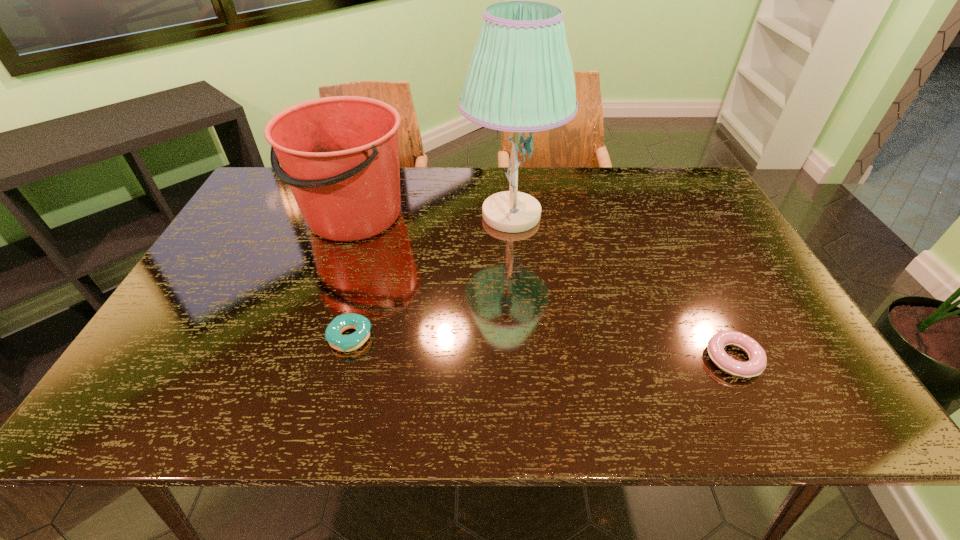
This screenshot has width=960, height=540. In order to click on bucket that is at the far edge in this screenshot , I will do `click(340, 155)`.

This screenshot has width=960, height=540. Identify the location of object that is at the right edge. (755, 366).

Image resolution: width=960 pixels, height=540 pixels. What are the coordinates of `free space at the far edge of the desktop` in the screenshot? It's located at (553, 169).

At what (x,y) coordinates should I click in order to perform the action: click on vacant space at the near edge of the desktop. Please return your answer as a coordinate pair (x, y). The height and width of the screenshot is (540, 960). Looking at the image, I should click on (728, 417).

You are a GUI agent. You are given a task and a screenshot of the screen. Output one action in this format:
    pyautogui.click(x=<x>, y=<y>)
    Task: Click on the free space at the left edge
    This screenshot has height=540, width=960.
    Given the screenshot: What is the action you would take?
    pyautogui.click(x=137, y=368)

Image resolution: width=960 pixels, height=540 pixels. I want to click on free spot at the near left corner of the desktop, so click(x=192, y=390).

Locate an element on the screen. The image size is (960, 540). empty space between the second object from right to left and the rightmost object is located at coordinates (622, 287).

Find the location of a particular element. This screenshot has width=960, height=540. empty space that is in between the left doughnut and the rightmost object is located at coordinates (541, 348).

Where is `vacant area between the tallest object and the left doughnut`? vacant area between the tallest object and the left doughnut is located at coordinates (431, 276).

Where is `free spot between the tallest object and the left doughnut`? This screenshot has height=540, width=960. free spot between the tallest object and the left doughnut is located at coordinates 431,276.